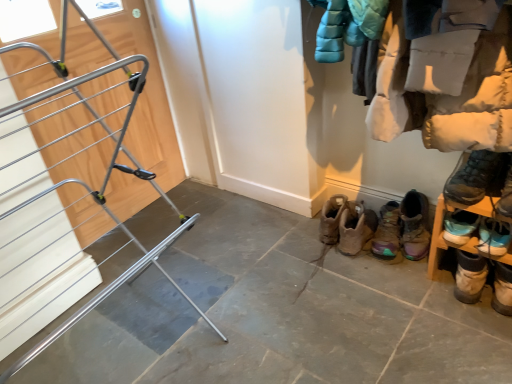
Where is `free space on the front side of camouflage fabric boot at lower center, which is counted as the 5th footwear, starting from the right`? This screenshot has width=512, height=384. free space on the front side of camouflage fabric boot at lower center, which is counted as the 5th footwear, starting from the right is located at coordinates (399, 282).